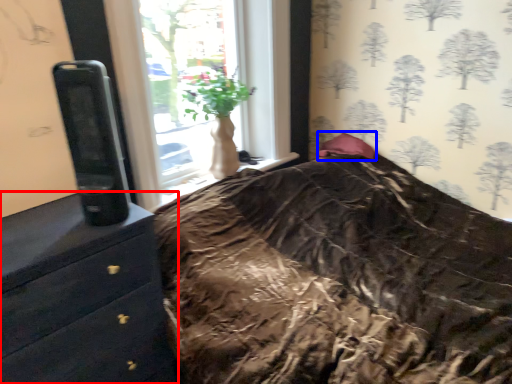
Question: Which of the following is the closest to the observer, chest of drawers (highlighted by a red box) or pillow (highlighted by a blue box)?

Choices:
 (A) chest of drawers
 (B) pillow

Answer: (A)